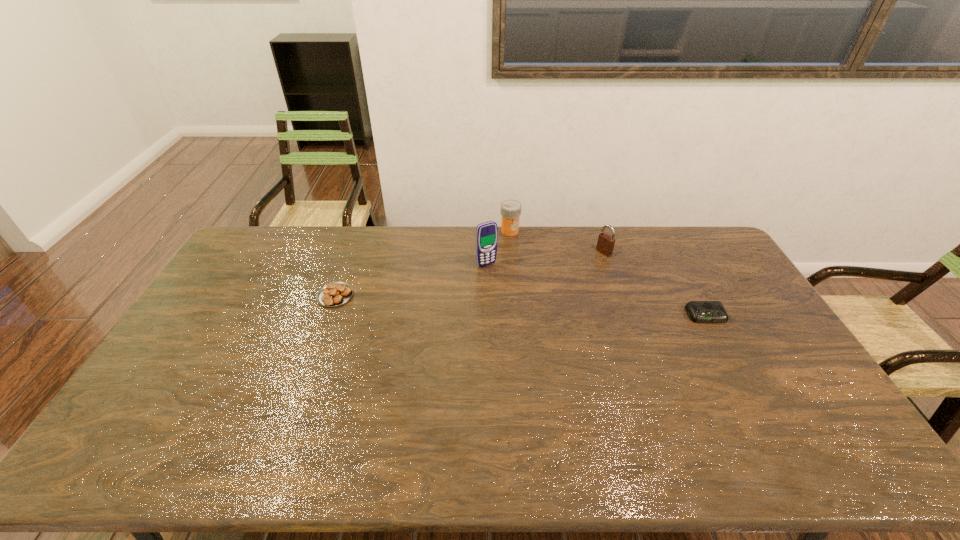
Where is `medicine that is at the far edge`? The image size is (960, 540). medicine that is at the far edge is located at coordinates (510, 209).

Where is `cellular telephone present at the far edge`? This screenshot has width=960, height=540. cellular telephone present at the far edge is located at coordinates (486, 233).

Locate an element on the screen. This screenshot has width=960, height=540. object that is positioned at the right edge is located at coordinates (699, 311).

In the image, there is a desktop. Where is `blank space at the far edge`? The height and width of the screenshot is (540, 960). blank space at the far edge is located at coordinates (463, 234).

Locate an element on the screen. This screenshot has height=540, width=960. vacant space at the near edge is located at coordinates (556, 420).

Where is `free space at the left edge of the desktop`? free space at the left edge of the desktop is located at coordinates (254, 294).

The image size is (960, 540). I want to click on free space at the right edge of the desktop, so [756, 330].

This screenshot has width=960, height=540. In order to click on vacant position at the near right corner of the desktop in this screenshot , I will do `click(807, 411)`.

What are the coordinates of `vacant region between the third nearest object and the fourth nearest object` in the screenshot? It's located at (545, 258).

You are a GUI agent. You are given a task and a screenshot of the screen. Output one action in this format:
    pyautogui.click(x=<x>, y=<y>)
    Task: Click on the empty space between the tallest object and the leftmost object
    
    Given the screenshot: What is the action you would take?
    pyautogui.click(x=411, y=280)